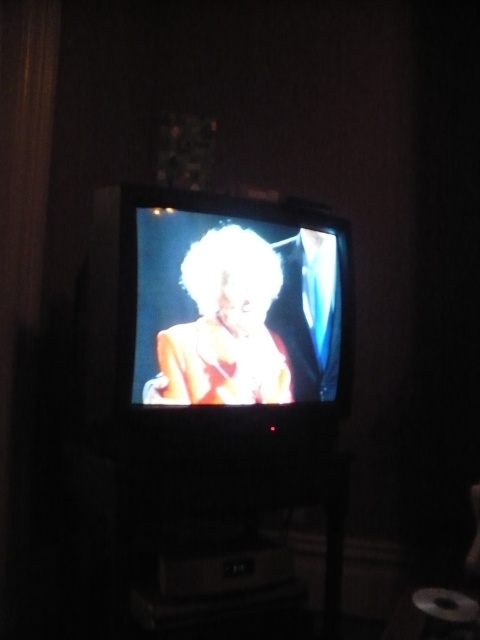
You are standing in the room and want to place a new decorative item between the shiny black television at center and the shiny gold dress at center. Based on their positions, which object should the decorative item be closer to?

The shiny black television at center is positioned on the left side of the shiny gold dress at center, so the decorative item should be placed closer to the shiny black television at center to maintain symmetry between the two objects.

You are standing in a room with a CRT television. You see a point marked at coordinates (215,314). What object is located at that point?

The point at coordinates (215,314) marks the shiny black television at center.

You are standing in the room and want to locate the shiny black television at center. What are the coordinates where you can find it?

The shiny black television at center is located at coordinates point (215, 314).